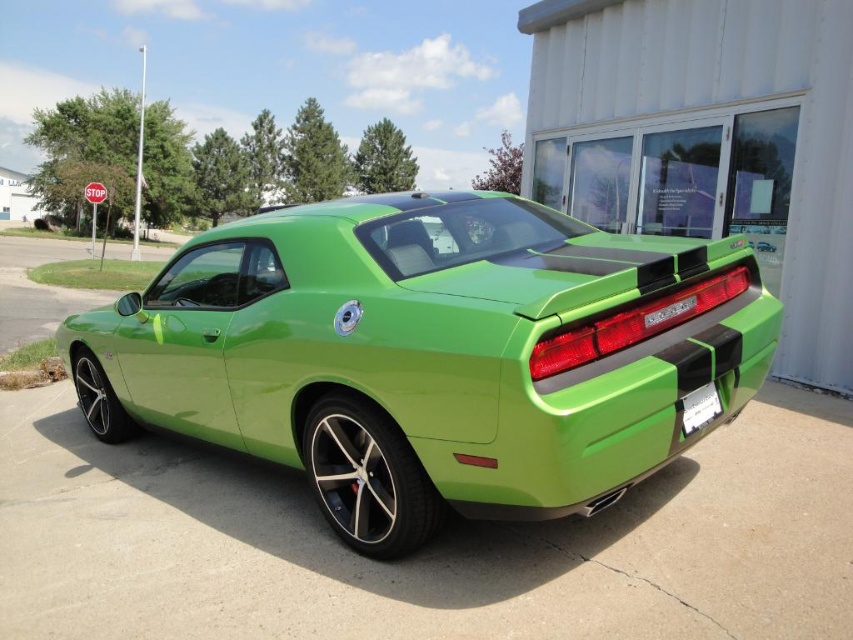
You are a delivery person trying to park your van next to the lime green matte car at center and the white plastic license plate at lower right. Since your van is 5 meters long, can you fit it between them without overlapping?

The lime green matte car at center is bigger than the white plastic license plate at lower right, but the distance between them isn not specified. Without knowing the exact spacing, it is impossible to determine if the van will fit.

You are a delivery person who needs to deliver a package to the white plastic license plate at lower right. The lime green matte car at center is blocking the path. Can you move the car to the right to clear the path?

The lime green matte car at center is to the left of the white plastic license plate at lower right, so moving it to the right would clear the path.